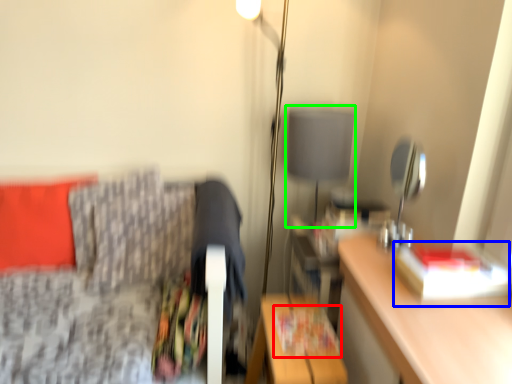
Question: Based on their relative distances, which object is nearer to magazine (highlighted by a red box)? Choose from book (highlighted by a blue box) and table lamp (highlighted by a green box).

Choices:
 (A) book
 (B) table lamp

Answer: (A)